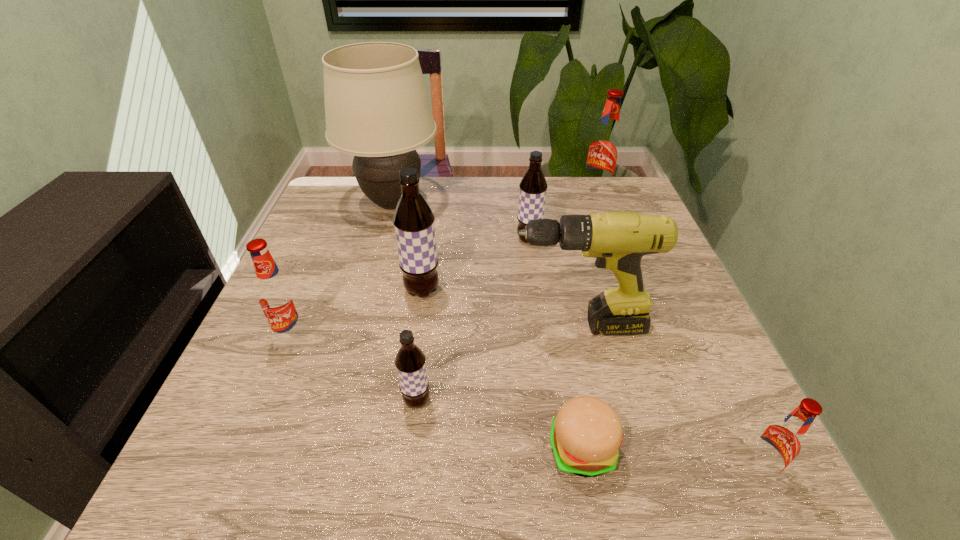
Locate an element on the screen. This screenshot has height=540, width=960. hamburger positioned at the near edge is located at coordinates (586, 434).

This screenshot has height=540, width=960. I want to click on lampshade that is at the left edge, so click(x=377, y=108).

The width and height of the screenshot is (960, 540). I want to click on root beer situated at the left edge, so click(x=277, y=296).

Identify the location of drill present at the right edge. The image size is (960, 540). [618, 239].

The image size is (960, 540). What are the coordinates of `object that is at the far left corner` in the screenshot? It's located at (377, 108).

I want to click on object that is at the far right corner, so click(x=604, y=148).

In order to click on object that is at the near right corner in this screenshot , I will do (x=780, y=442).

Find the location of `vacant space at the far edge of the desktop`. vacant space at the far edge of the desktop is located at coordinates [x=576, y=194].

The width and height of the screenshot is (960, 540). In the image, there is a desktop. In order to click on free space at the near edge in this screenshot , I will do `click(659, 466)`.

This screenshot has width=960, height=540. Identify the location of free space at the left edge. (351, 251).